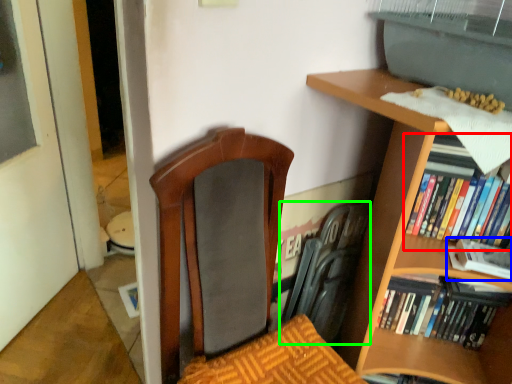
Question: Which object is the farthest from book (highlighted by a red box)? Choose among these: book (highlighted by a blue box) or swivel chair (highlighted by a green box).

Choices:
 (A) book
 (B) swivel chair

Answer: (B)